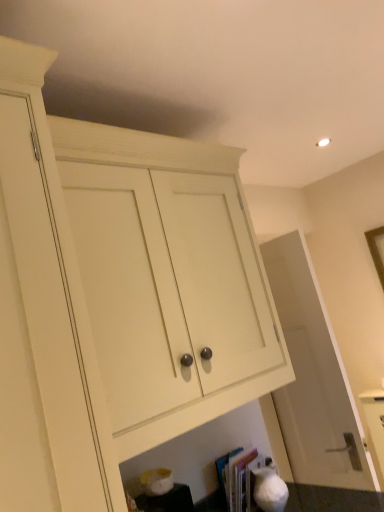
What do you see at coordinates (128, 283) in the screenshot?
I see `white wood cabinet at center` at bounding box center [128, 283].

Locate an element on the screen. The width and height of the screenshot is (384, 512). white matte door at center is located at coordinates (314, 378).

Based on their sizes in the image, would you say hardcover book at lower center is bigger or smaller than white wood cabinet at center?

Considering their sizes, hardcover book at lower center takes up less space than white wood cabinet at center.

Considering the sizes of hardcover book at lower center and white wood cabinet at center in the image, is hardcover book at lower center wider or thinner than white wood cabinet at center?

hardcover book at lower center is thinner than white wood cabinet at center.

Does point (248, 510) come closer to viewer compared to point (330, 465)?

That is True.

Considering their positions, is hardcover book at lower center located in front of or behind white matte door at center?

Visually, hardcover book at lower center is located in front of white matte door at center.

Is point (232, 326) farther from camera compared to point (244, 509)?

That is False.

Who is taller, white wood cabinet at center or hardcover book at lower center?

With more height is white wood cabinet at center.

Can you confirm if white wood cabinet at center is thinner than hardcover book at lower center?

No, white wood cabinet at center is not thinner than hardcover book at lower center.

Is hardcover book at lower center at the back of white wood cabinet at center?

No, white wood cabinet at center is not facing away from hardcover book at lower center.

Considering the relative sizes of white matte door at center and hardcover book at lower center in the image provided, is white matte door at center bigger than hardcover book at lower center?

Indeed, white matte door at center has a larger size compared to hardcover book at lower center.

How far apart are white matte door at center and hardcover book at lower center?

white matte door at center and hardcover book at lower center are 22.93 inches apart.

Would you say white matte door at center is to the left or to the right of hardcover book at lower center in the picture?

white matte door at center is to the right of hardcover book at lower center.

From the picture: Considering the sizes of objects white matte door at center and hardcover book at lower center in the image provided, who is shorter, white matte door at center or hardcover book at lower center?

Standing shorter between the two is hardcover book at lower center.

Is white wood cabinet at center not inside white matte door at center?

white wood cabinet at center lies outside white matte door at center's area.

The image size is (384, 512). What are the coordinates of `cabinetry above the white matte door at center (from the image's perspective)` in the screenshot? It's located at (128, 283).

In the scene shown: Considering the sizes of objects white wood cabinet at center and white matte door at center in the image provided, who is shorter, white wood cabinet at center or white matte door at center?

With less height is white wood cabinet at center.

Can white wood cabinet at center be found inside white matte door at center?

No, white wood cabinet at center is not surrounded by white matte door at center.

Which is more to the right, white matte door at center or white wood cabinet at center?

white matte door at center is more to the right.

Are white matte door at center and white wood cabinet at center far apart?

No.

What are the coordinates of `door below the white wood cabinet at center (from a real-world perspective)` in the screenshot? It's located at (314, 378).

The width and height of the screenshot is (384, 512). Identify the location of cabinetry in front of the hardcover book at lower center. (128, 283).

Where is `door lying above the hardcover book at lower center (from the image's perspective)`? The height and width of the screenshot is (512, 384). door lying above the hardcover book at lower center (from the image's perspective) is located at coordinates (314, 378).

Based on their spatial positions, is white wood cabinet at center or hardcover book at lower center further from white matte door at center?

Among the two, white wood cabinet at center is located further to white matte door at center.

Consider the image. From the image, which object appears to be nearer to hardcover book at lower center, white wood cabinet at center or white matte door at center?

white matte door at center is closer to hardcover book at lower center.

Which object lies further to the anchor point white wood cabinet at center, white matte door at center or hardcover book at lower center?

hardcover book at lower center is further to white wood cabinet at center.

Estimate the real-world distances between objects in this image. Which object is closer to white matte door at center, hardcover book at lower center or white wood cabinet at center?

Based on the image, hardcover book at lower center appears to be nearer to white matte door at center.

Looking at the image, which one is located closer to white wood cabinet at center, hardcover book at lower center or white matte door at center?

white matte door at center is positioned closer to the anchor white wood cabinet at center.

Estimate the real-world distances between objects in this image. Which object is further from hardcover book at lower center, white matte door at center or white wood cabinet at center?

white wood cabinet at center is further to hardcover book at lower center.

Image resolution: width=384 pixels, height=512 pixels. In order to click on door between white wood cabinet at center and hardcover book at lower center vertically in this screenshot , I will do `click(314, 378)`.